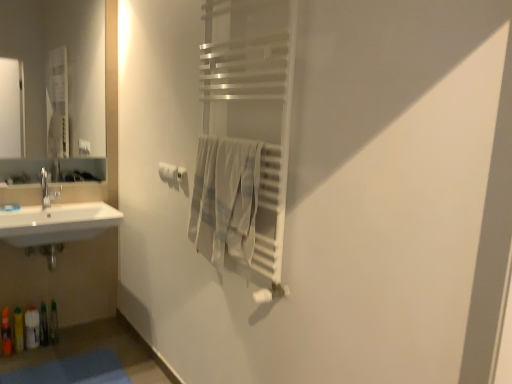
You are a GUI agent. You are given a task and a screenshot of the screen. Output one action in this format:
    pyautogui.click(x=<x>, y=<y>)
    Task: Click on the translucent plastic bottles at lower left, which ranks as the third toiletry in left-to-right order
    
    Given the screenshot: What is the action you would take?
    pyautogui.click(x=32, y=327)

You are a GUI agent. You are given a task and a screenshot of the screen. Output one action in this format:
    pyautogui.click(x=<x>, y=<y>)
    Task: Click on the white matte toilet paper at center
    The width and height of the screenshot is (512, 384).
    Given the screenshot: What is the action you would take?
    pyautogui.click(x=170, y=172)

Locate an element on the screen. The width and height of the screenshot is (512, 384). brushed metal faucet at left is located at coordinates (48, 189).

I want to click on translucent plastic bottles at lower left, the fourth toiletry viewed from the left, so click(54, 324).

This screenshot has width=512, height=384. In order to click on matte silver mirror at upper left in this screenshot , I will do `click(68, 64)`.

Where is `translucent plastic bottles at lower left, the second toiletry when ordered from right to left`? The height and width of the screenshot is (384, 512). translucent plastic bottles at lower left, the second toiletry when ordered from right to left is located at coordinates (32, 327).

Between blue fabric bath mat at lower left and brushed metal faucet at left, which one has larger size?

blue fabric bath mat at lower left is bigger.

Which object is positioned more to the right, blue fabric bath mat at lower left or brushed metal faucet at left?

blue fabric bath mat at lower left is more to the right.

From a real-world perspective, is blue fabric bath mat at lower left on brushed metal faucet at left?

No, from a real-world perspective, blue fabric bath mat at lower left is not on top of brushed metal faucet at left.

From the picture: Is blue fabric bath mat at lower left looking in the opposite direction of brushed metal faucet at left?

No, brushed metal faucet at left is not at the back of blue fabric bath mat at lower left.

Can you confirm if translucent plastic bottles at lower left, which ranks as the third toiletry in left-to-right order, is thinner than light beige cotton towel at center?

In fact, translucent plastic bottles at lower left, which ranks as the third toiletry in left-to-right order, might be wider than light beige cotton towel at center.

Considering the positions of points (26, 344) and (245, 172), is point (26, 344) farther from camera compared to point (245, 172)?

Yes, it is behind point (245, 172).

Could you tell me if translucent plastic bottles at lower left, which ranks as the third toiletry in left-to-right order, is turned towards light beige cotton towel at center?

No.

Considering the sizes of objects translucent plastic bottles at lower left, which ranks as the third toiletry in left-to-right order, and light beige cotton towel at center in the image provided, who is bigger, translucent plastic bottles at lower left, which ranks as the third toiletry in left-to-right order, or light beige cotton towel at center?

With larger size is light beige cotton towel at center.

Who is shorter, translucent plastic bottles at lower left, the 3th toiletry in the right-to-left sequence, or brushed metal faucet at left?

With less height is brushed metal faucet at left.

Is translucent plastic bottles at lower left, which is the 2th toiletry in left-to-right order, to the right of brushed metal faucet at left from the viewer's perspective?

No.

Identify the location of tap behind the translucent plastic bottles at lower left, the 3th toiletry in the right-to-left sequence. (48, 189).

Is the position of translucent plastic bottles at lower left, which is the 2th toiletry in left-to-right order, less distant than that of brushed metal faucet at left?

Yes, translucent plastic bottles at lower left, which is the 2th toiletry in left-to-right order, is in front of brushed metal faucet at left.

Is matte silver mirror at upper left positioned far away from satin nickel towel bar at center?

Yes, matte silver mirror at upper left and satin nickel towel bar at center are located far from each other.

Looking at this image, which is in front, matte silver mirror at upper left or satin nickel towel bar at center?

Positioned in front is satin nickel towel bar at center.

Looking at this image, from the image's perspective, would you say matte silver mirror at upper left is positioned over satin nickel towel bar at center?

A: Yes, from the image's perspective, matte silver mirror at upper left is over satin nickel towel bar at center.

Between matte silver mirror at upper left and satin nickel towel bar at center, which one appears on the right side from the viewer's perspective?

satin nickel towel bar at center is more to the right.

Is blue fabric bath mat at lower left oriented away from white matte toilet paper at center?

No, white matte toilet paper at center is not at the back of blue fabric bath mat at lower left.

Is blue fabric bath mat at lower left touching white matte toilet paper at center?

blue fabric bath mat at lower left and white matte toilet paper at center are not in contact.

Is blue fabric bath mat at lower left surrounding white matte toilet paper at center?

Actually, white matte toilet paper at center is outside blue fabric bath mat at lower left.

Is translucent plastic bottles at lower left, the second toiletry when ordered from right to left, positioned with its back to satin nickel towel bar at center?

That's not correct — translucent plastic bottles at lower left, the second toiletry when ordered from right to left, is not looking away from satin nickel towel bar at center.

Considering the positions of point (34, 321) and point (185, 171), is point (34, 321) closer or farther from the camera than point (185, 171)?

Point (34, 321) appears to be farther away from the viewer than point (185, 171).

Who is bigger, translucent plastic bottles at lower left, the second toiletry when ordered from right to left, or satin nickel towel bar at center?

translucent plastic bottles at lower left, the second toiletry when ordered from right to left.

Considering the sizes of objects translucent plastic bottles at lower left, the 3th toiletry in the right-to-left sequence, and matte silver mirror at upper left in the image provided, who is bigger, translucent plastic bottles at lower left, the 3th toiletry in the right-to-left sequence, or matte silver mirror at upper left?

With larger size is matte silver mirror at upper left.

From a real-world perspective, is translucent plastic bottles at lower left, which is the 2th toiletry in left-to-right order, physically below matte silver mirror at upper left?

Indeed, from a real-world perspective, translucent plastic bottles at lower left, which is the 2th toiletry in left-to-right order, is positioned beneath matte silver mirror at upper left.

From the image's perspective, relative to matte silver mirror at upper left, is translucent plastic bottles at lower left, the 3th toiletry in the right-to-left sequence, above or below?

translucent plastic bottles at lower left, the 3th toiletry in the right-to-left sequence, is situated lower than matte silver mirror at upper left in the image.

Is translucent plastic bottles at lower left, which is the 2th toiletry in left-to-right order, wider or thinner than matte silver mirror at upper left?

Clearly, translucent plastic bottles at lower left, which is the 2th toiletry in left-to-right order, has more width compared to matte silver mirror at upper left.

Where is `tap located above the blue fabric bath mat at lower left (from a real-world perspective)`? Image resolution: width=512 pixels, height=384 pixels. tap located above the blue fabric bath mat at lower left (from a real-world perspective) is located at coordinates (48, 189).

Where is `the 3rd toiletry behind the light beige cotton towel at center, counting from the anchor's position`? Image resolution: width=512 pixels, height=384 pixels. the 3rd toiletry behind the light beige cotton towel at center, counting from the anchor's position is located at coordinates (32, 327).

When comparing their distances from translucent plastic bottles at lower left, the second toiletry when ordered from right to left, does brushed metal faucet at left or light beige cotton towel at center seem further?

Based on the image, light beige cotton towel at center appears to be further to translucent plastic bottles at lower left, the second toiletry when ordered from right to left.

When comparing their distances from translucent plastic bottle at lower left, the 1th toiletry from the left, does translucent plastic bottles at lower left, the second toiletry when ordered from right to left, or translucent plastic bottles at lower left, the fourth toiletry viewed from the left, seem further?

translucent plastic bottles at lower left, the fourth toiletry viewed from the left, is further to translucent plastic bottle at lower left, the 1th toiletry from the left.

Based on their spatial positions, is satin silver towel rack at center or translucent plastic bottles at lower left, which ranks as the third toiletry in left-to-right order, further from translucent plastic bottle at lower left, the 1th toiletry from the left?

The object further to translucent plastic bottle at lower left, the 1th toiletry from the left, is satin silver towel rack at center.

Considering their positions, is translucent plastic bottles at lower left, the second toiletry when ordered from right to left, positioned further to white matte toilet paper at center than light beige cotton towel at center?

The object further to white matte toilet paper at center is translucent plastic bottles at lower left, the second toiletry when ordered from right to left.

Consider the image. When comparing their distances from blue fabric bath mat at lower left, does translucent plastic bottles at lower left, the second toiletry when ordered from right to left, or matte silver mirror at upper left seem closer?

translucent plastic bottles at lower left, the second toiletry when ordered from right to left, is positioned closer to the anchor blue fabric bath mat at lower left.

From the image, which object appears to be farther from satin silver towel rack at center, blue fabric bath mat at lower left or translucent plastic bottles at lower left, the 3th toiletry in the right-to-left sequence?

translucent plastic bottles at lower left, the 3th toiletry in the right-to-left sequence.

From the image, which object appears to be farther from translucent plastic bottles at lower left, positioned as the 1th toiletry in right-to-left order, satin nickel towel bar at center or white matte toilet paper at center?

satin nickel towel bar at center is further to translucent plastic bottles at lower left, positioned as the 1th toiletry in right-to-left order.

Looking at the image, which one is located closer to translucent plastic bottles at lower left, the fourth toiletry viewed from the left, white matte toilet paper at center or light beige cotton towel at center?

The object closer to translucent plastic bottles at lower left, the fourth toiletry viewed from the left, is white matte toilet paper at center.

Identify the location of towel bar located between translucent plastic bottle at lower left, the 1th toiletry from the left, and satin silver towel rack at center in the left-right direction. (181, 174).

Where is `toilet paper located between translucent plastic bottles at lower left, which is the 2th toiletry in left-to-right order, and light beige cotton towel at center in the left-right direction`? This screenshot has height=384, width=512. toilet paper located between translucent plastic bottles at lower left, which is the 2th toiletry in left-to-right order, and light beige cotton towel at center in the left-right direction is located at coordinates (170, 172).

Identify the location of towel bar positioned between satin silver towel rack at center and translucent plastic bottles at lower left, positioned as the 1th toiletry in right-to-left order, from near to far. (181, 174).

Locate an element on the screen. The height and width of the screenshot is (384, 512). towel bar between matte silver mirror at upper left and blue fabric bath mat at lower left in the up-down direction is located at coordinates (181, 174).